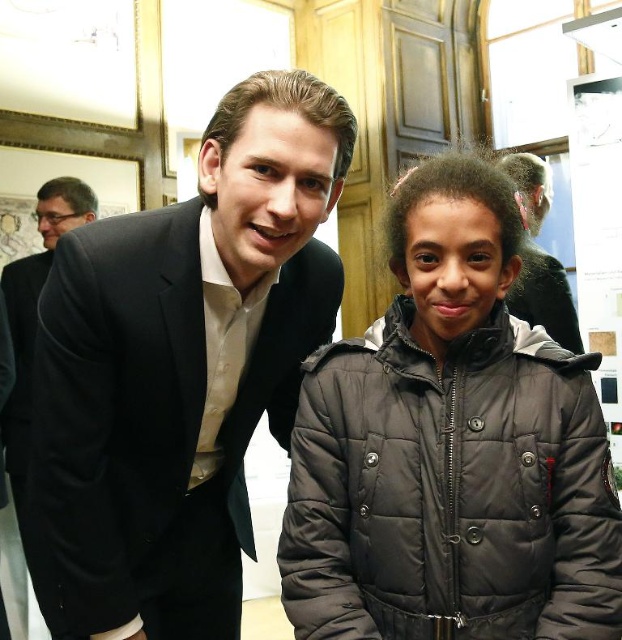
You are a photographer setting up for a group photo. You need to position two people so that their jackets are visible. The dark gray puffer jacket at center and the matte black suit at center are both at the center. Which one should stand closer to the camera to ensure both jackets are fully visible in the photo?

The dark gray puffer jacket at center is already closer to the viewer than the matte black suit at center. To ensure both jackets are fully visible, the person in the matte black suit at center should move slightly forward so that both are at a similar distance from the camera.